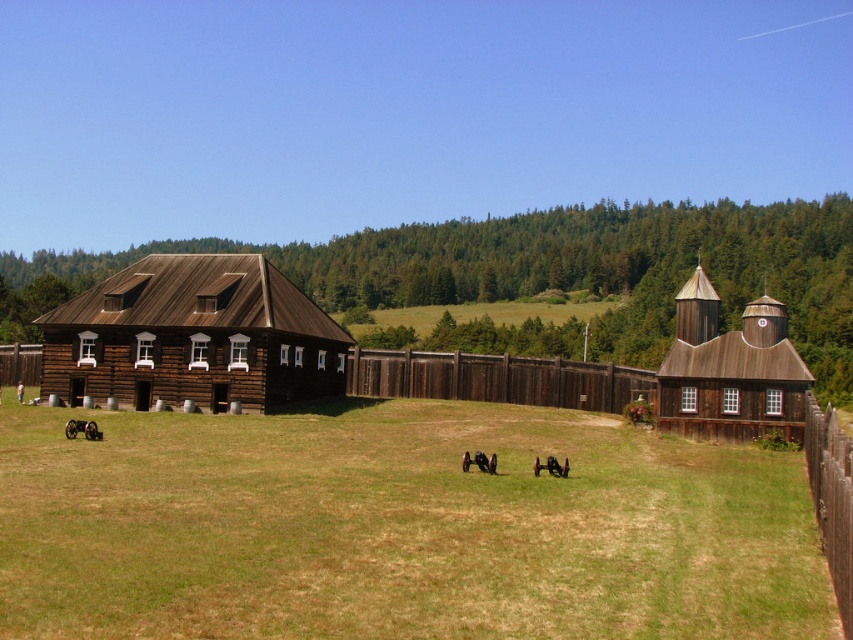
Which is below, green grass at center or brown wooden barn at center?

green grass at center is below.

Between green grass at center and brown wooden barn at center, which one has less height?

green grass at center is shorter.

Does point (527, 577) come behind point (238, 321)?

No.

Identify the location of green grass at center. This screenshot has height=640, width=853. (398, 529).

Is wooden tower at center-right shorter than brown wooden fence at right?

No, wooden tower at center-right is not shorter than brown wooden fence at right.

Who is more forward, (746,320) or (849,474)?

Point (849,474) is more forward.

This screenshot has height=640, width=853. I want to click on wooden tower at center-right, so click(x=730, y=371).

Based on the photo, who is positioned more to the left, brown wooden fence at center or brown wooden fence at right?

From the viewer's perspective, brown wooden fence at center appears more on the left side.

Describe the element at coordinates (497, 378) in the screenshot. I see `brown wooden fence at center` at that location.

Where is `brown wooden fence at center`? The image size is (853, 640). brown wooden fence at center is located at coordinates (497, 378).